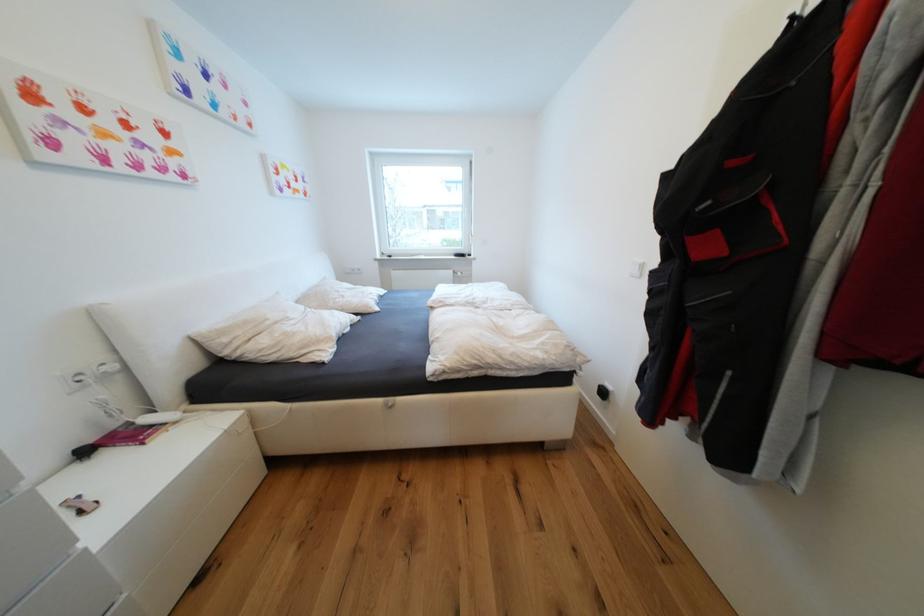
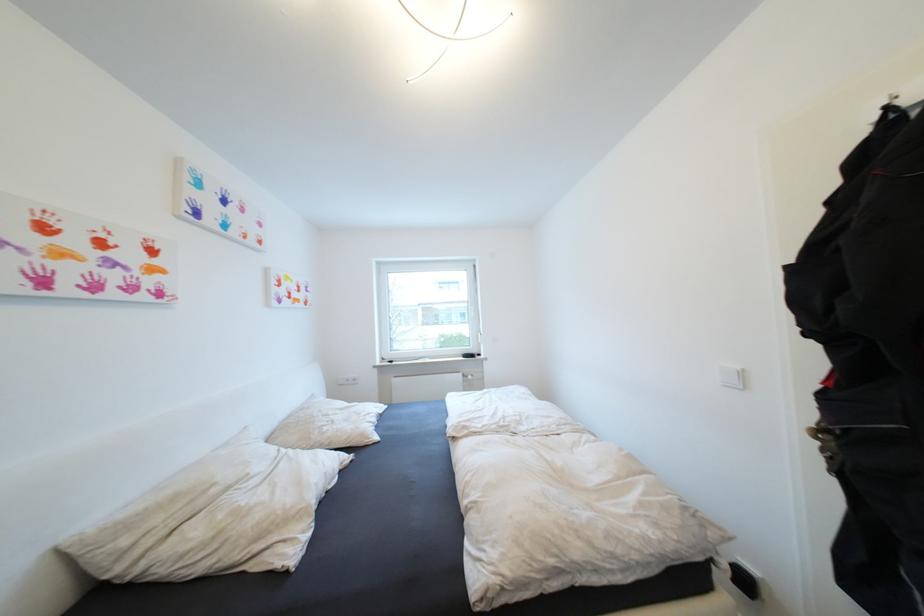
The point at (233, 341) is marked in the first image. Where is the corresponding point in the second image?

(131, 543)